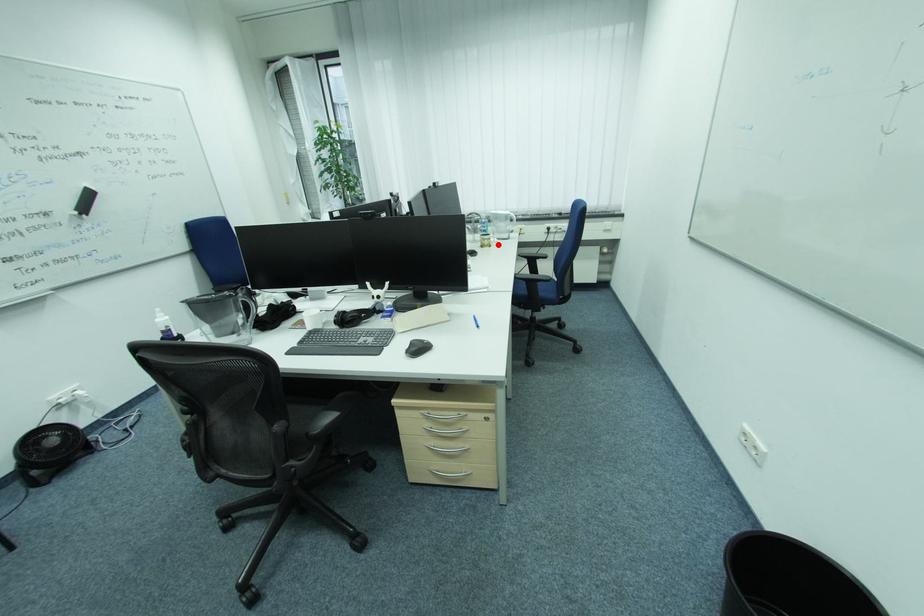
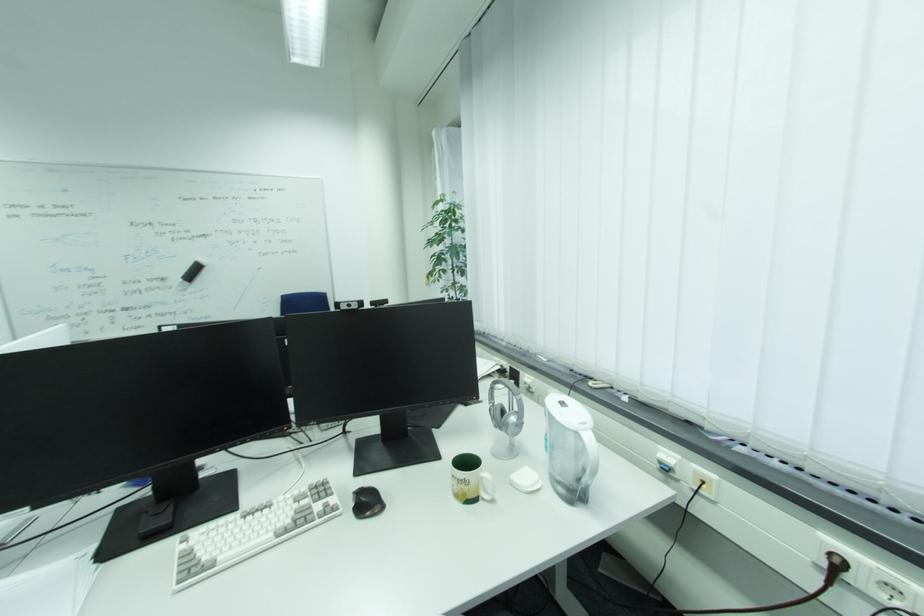
Where in the second image is the point corresponding to the highlighted location from the first image?

(490, 496)